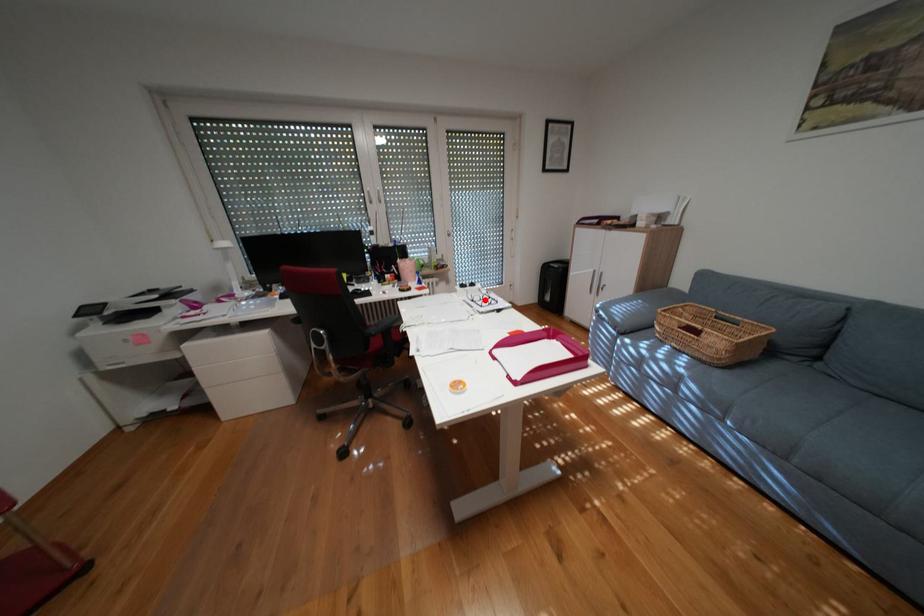
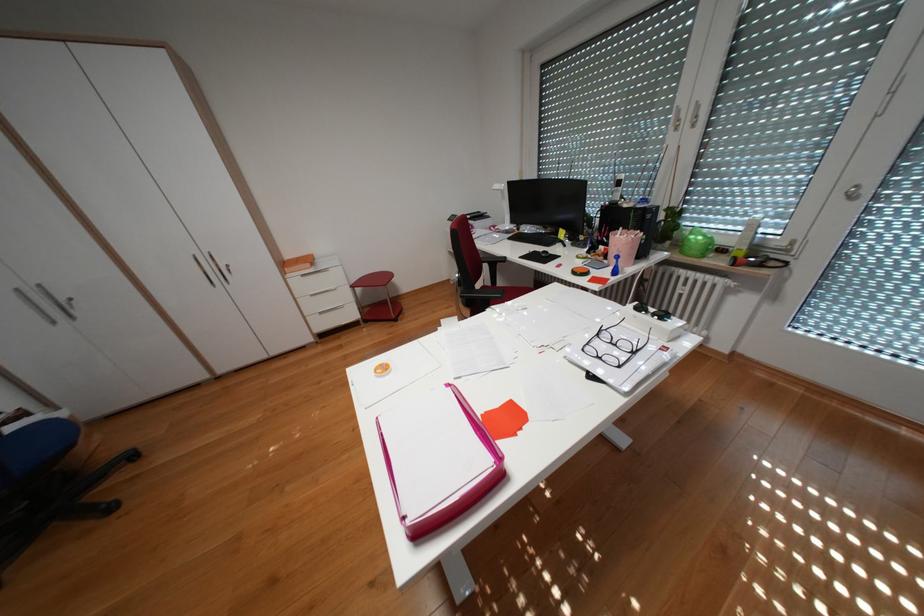
The point at the highlighted location is marked in the first image. Where is the corresponding point in the second image?

(610, 334)